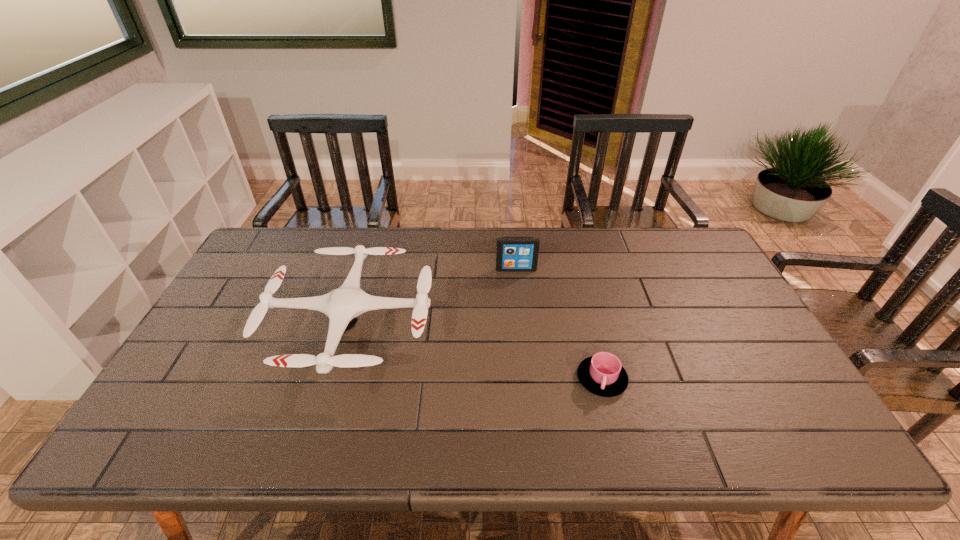
Locate an element on the screen. iPod is located at coordinates (513, 254).

The image size is (960, 540). In order to click on the farthest object in this screenshot , I will do click(x=513, y=254).

You are a GUI agent. You are given a task and a screenshot of the screen. Output one action in this format:
    pyautogui.click(x=<x>, y=<y>)
    Task: Click on the leftmost object
    The height and width of the screenshot is (540, 960).
    Given the screenshot: What is the action you would take?
    343,305

The height and width of the screenshot is (540, 960). I want to click on cup, so click(602, 374).

Where is `the rightmost object`? The width and height of the screenshot is (960, 540). the rightmost object is located at coordinates (602, 374).

Locate an element on the screen. free region located 0.110m on the front screen of the iPod is located at coordinates (518, 295).

In order to click on vacant point located 0.100m with the camera attached at the bottom of the leftmost object in this screenshot , I will do click(x=320, y=433).

Locate an element on the screen. The image size is (960, 540). free space located 0.100m on the side with the handle of the cup is located at coordinates (616, 440).

The height and width of the screenshot is (540, 960). In order to click on object positioned at the far edge in this screenshot , I will do `click(513, 254)`.

Find the location of a particular element. vacant area at the far edge is located at coordinates (358, 243).